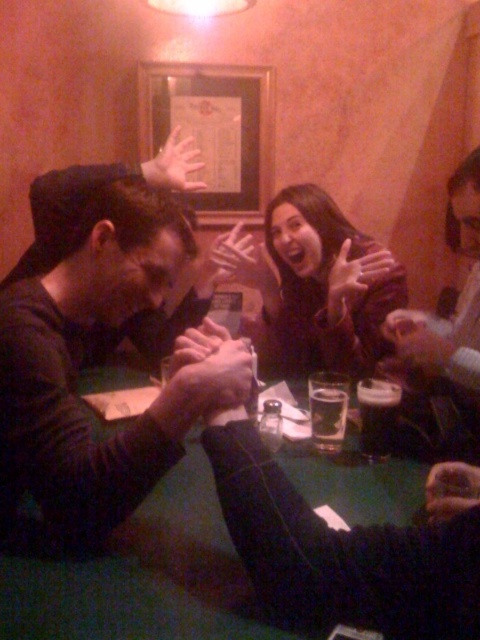
Question: Which object is the closest to the dark brown liquid at table center?

Choices:
 (A) smooth skin hand at lower right
 (B) matte skin hand at center

Answer: (A)

Question: Which point is farther to the camera?

Choices:
 (A) (149, 164)
 (B) (324, 451)
 (C) (20, 481)

Answer: (A)

Question: Can you confirm if smooth leather jacket at upper right is smaller than smooth skin hand at center?

Choices:
 (A) no
 (B) yes

Answer: (A)

Question: Does matte black shirt at left have a larger size compared to smooth skin hand at lower right?

Choices:
 (A) yes
 (B) no

Answer: (A)

Question: Is dark brown liquid at table center positioned before translucent plastic hand at center?

Choices:
 (A) yes
 (B) no

Answer: (A)

Question: Which point appears farthest from the camera in this image?

Choices:
 (A) (386, 321)
 (B) (239, 252)
 (C) (340, 289)

Answer: (B)